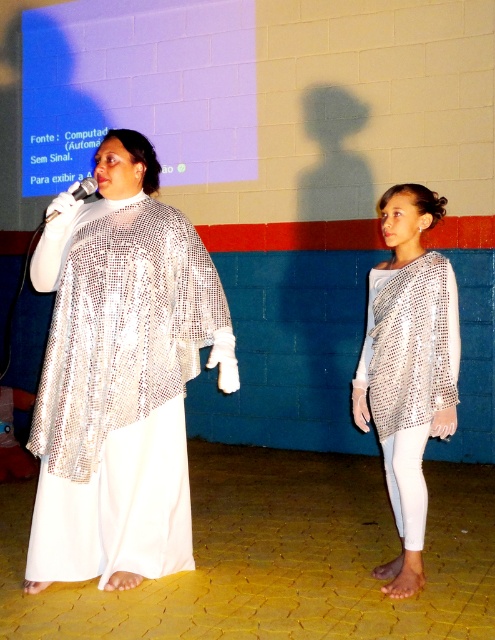
Question: Which point is farther to the camera?

Choices:
 (A) (398, 317)
 (B) (44, 570)

Answer: (A)

Question: Which of the following is the farthest from the observer?

Choices:
 (A) silver mesh top at center
 (B) shiny metallic robe at left

Answer: (A)

Question: Can you confirm if shiny metallic robe at left is bigger than silver mesh top at center?

Choices:
 (A) yes
 (B) no

Answer: (A)

Question: Which point is closer to the camera taking this photo?

Choices:
 (A) (454, 394)
 (B) (115, 497)

Answer: (A)

Question: Does shiny metallic robe at left have a lesser width compared to silver mesh top at center?

Choices:
 (A) yes
 (B) no

Answer: (B)

Question: Is shiny metallic robe at left above silver mesh top at center?

Choices:
 (A) no
 (B) yes

Answer: (A)